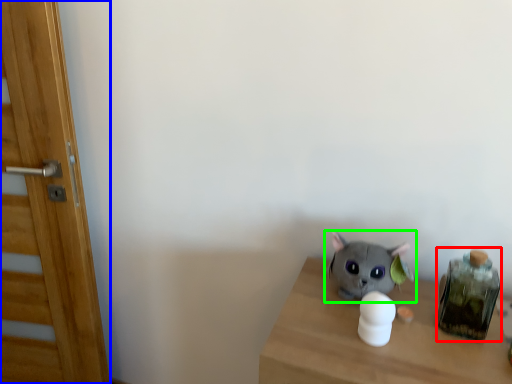
Question: Which is nearer to the glass jar (highlighted by a red box)? door (highlighted by a blue box) or toy (highlighted by a green box).

Choices:
 (A) door
 (B) toy

Answer: (B)